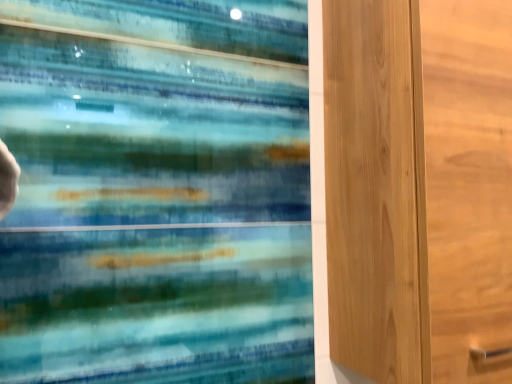
I want to click on light brown wood door at right, so click(386, 195).

This screenshot has width=512, height=384. What do you see at coordinates (386, 195) in the screenshot? I see `light brown wood door at right` at bounding box center [386, 195].

Where is `light brown wood door at right`? light brown wood door at right is located at coordinates (386, 195).